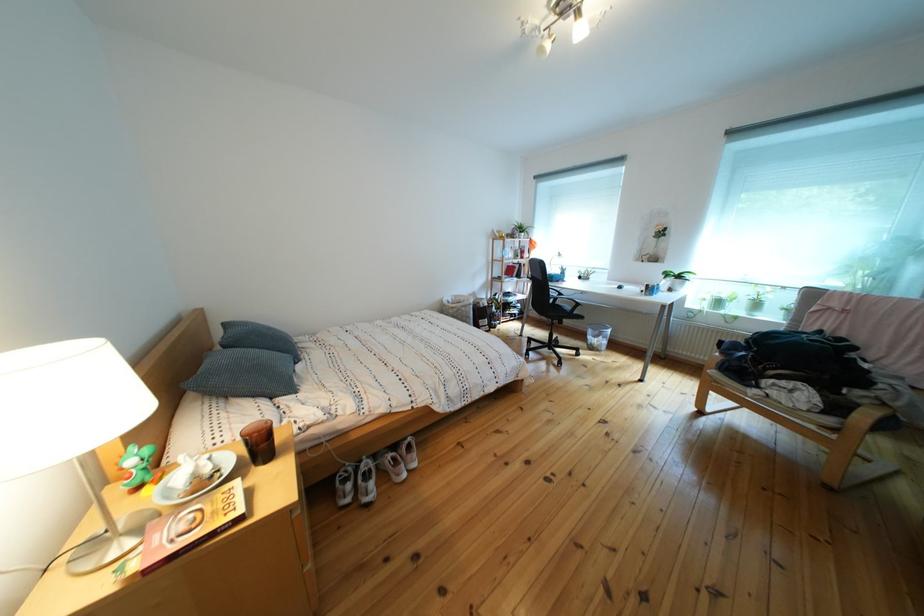
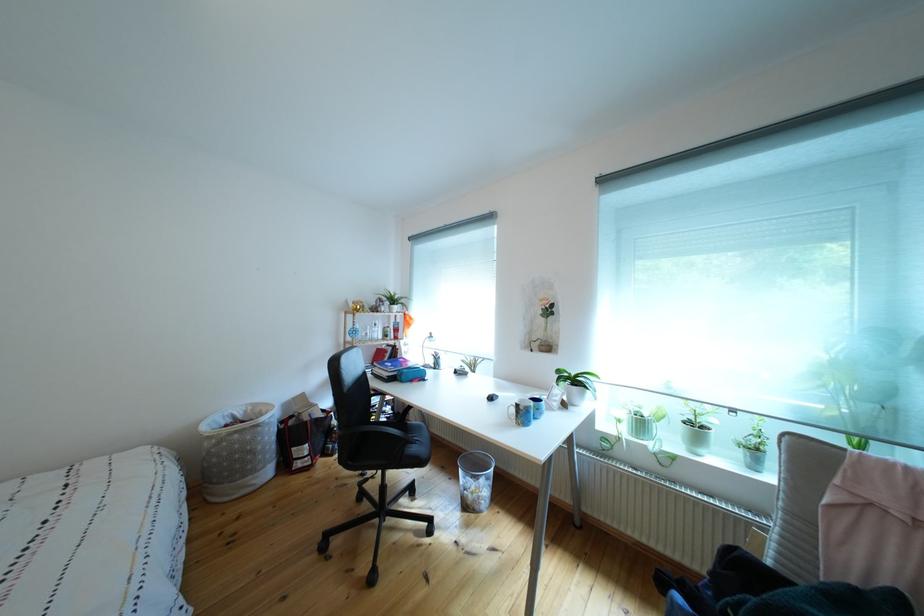
The point at (690,283) is marked in the first image. Where is the corresponding point in the second image?

(588, 387)